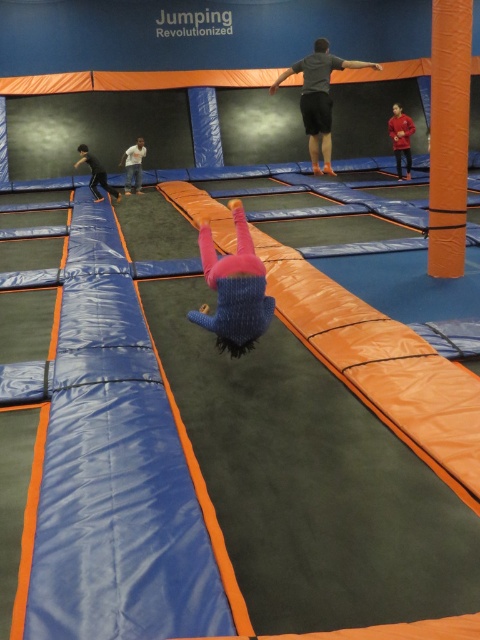
Question: Among these points, which one is nearest to the camera?

Choices:
 (A) (249, 248)
 (B) (127, 186)
 (C) (98, 182)
 (D) (406, 161)

Answer: (A)

Question: Can you confirm if white cotton shirt at upper center is bigger than blue fuzzy sweater at left?

Choices:
 (A) no
 (B) yes

Answer: (A)

Question: Which of the following is the closest to the observer?

Choices:
 (A) blue fuzzy sweater at left
 (B) white cotton shirt at upper center

Answer: (A)

Question: Can you confirm if red fleece jacket at upper right is positioned to the left of blue fuzzy sweater at left?

Choices:
 (A) no
 (B) yes

Answer: (A)

Question: Which of the following is the closest to the observer?

Choices:
 (A) gray fabric shorts at center
 (B) knitted pink pants at center
 (C) red fleece jacket at upper right

Answer: (B)

Question: Is knitted pink pants at center above gray fabric shorts at center?

Choices:
 (A) no
 (B) yes

Answer: (A)